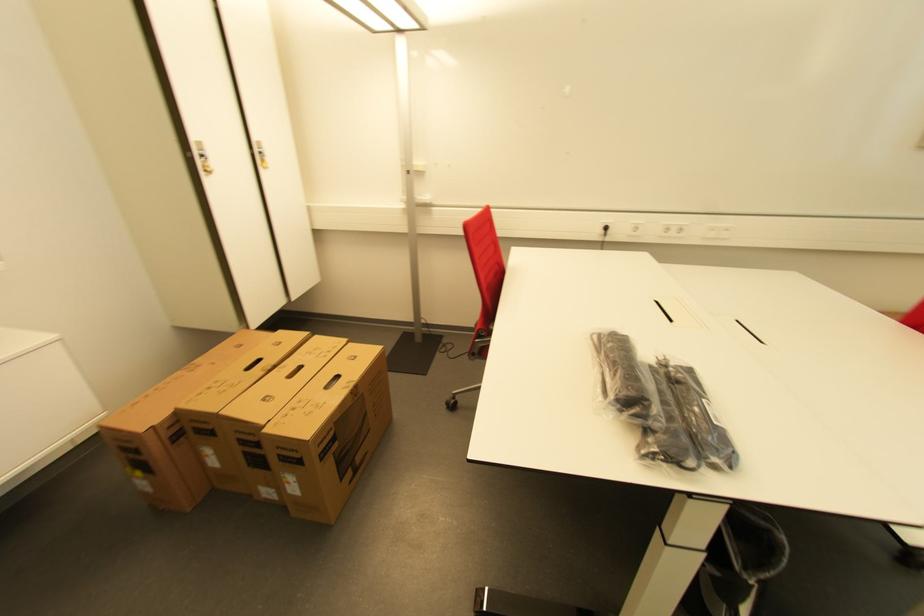
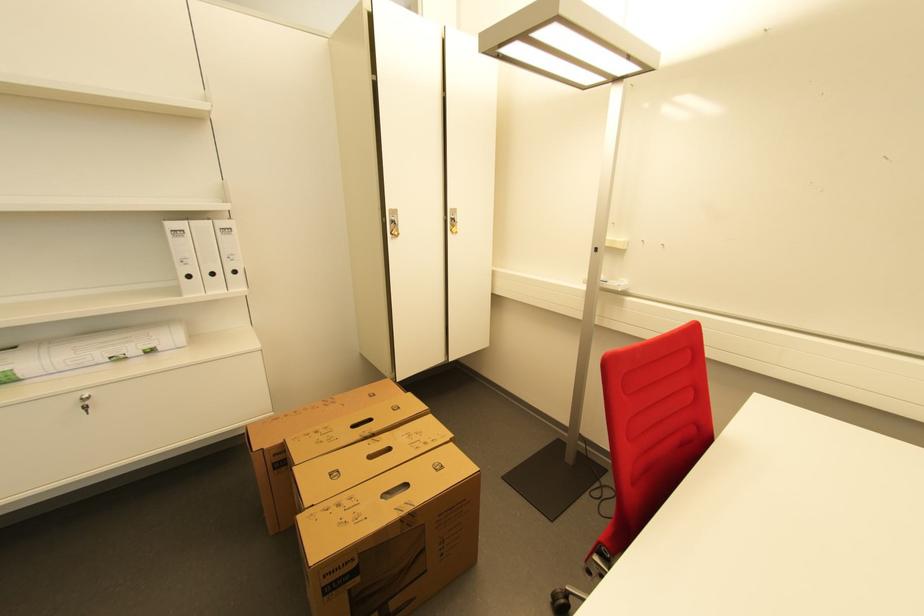
Where in the second image is the point corresponding to [296,378] from the first image?

(377, 458)